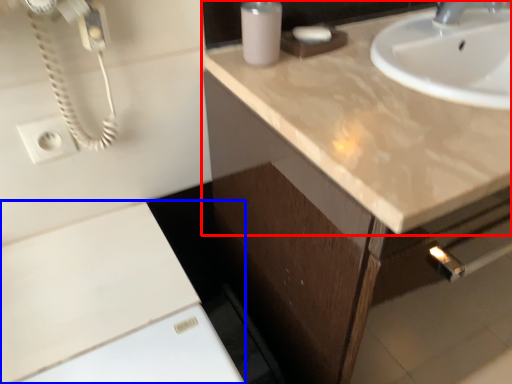
Question: Which object appears farthest to the camera in this image, countertop (highlighted by a red box) or cabinetry (highlighted by a blue box)?

Choices:
 (A) countertop
 (B) cabinetry

Answer: (B)